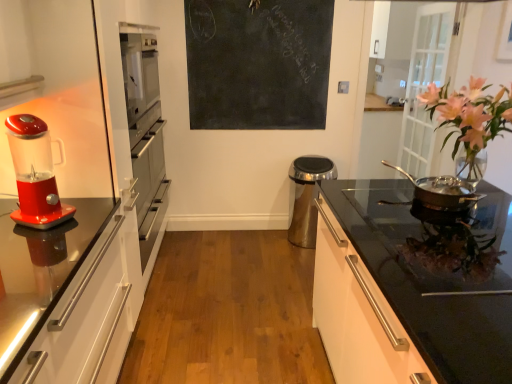
Question: Is shiny plastic blender at left to the left of shiny silver pan at right from the viewer's perspective?

Choices:
 (A) no
 (B) yes

Answer: (B)

Question: Can you confirm if shiny plastic blender at left is thinner than shiny silver pan at right?

Choices:
 (A) no
 (B) yes

Answer: (B)

Question: Is shiny plastic blender at left next to shiny silver pan at right?

Choices:
 (A) no
 (B) yes

Answer: (A)

Question: From a real-world perspective, is shiny plastic blender at left on top of shiny silver pan at right?

Choices:
 (A) no
 (B) yes

Answer: (B)

Question: Considering the relative sizes of shiny plastic blender at left and shiny silver pan at right in the image provided, is shiny plastic blender at left smaller than shiny silver pan at right?

Choices:
 (A) no
 (B) yes

Answer: (A)

Question: Looking at the image, does shiny plastic blender at left seem bigger or smaller compared to satin silver trash can at center?

Choices:
 (A) big
 (B) small

Answer: (B)

Question: From the image's perspective, is shiny plastic blender at left located above or below satin silver trash can at center?

Choices:
 (A) below
 (B) above

Answer: (B)

Question: Would you say shiny plastic blender at left is to the left or to the right of satin silver trash can at center in the picture?

Choices:
 (A) left
 (B) right

Answer: (A)

Question: Do you think shiny plastic blender at left is within satin silver trash can at center, or outside of it?

Choices:
 (A) outside
 (B) inside

Answer: (A)

Question: Does point click(214, 41) appear closer or farther from the camera than point click(463, 163)?

Choices:
 (A) closer
 (B) farther

Answer: (B)

Question: Is black chalkboard at upper center wider or thinner than pink glass vase at right?

Choices:
 (A) thin
 (B) wide

Answer: (A)

Question: From a real-world perspective, is black chalkboard at upper center above or below pink glass vase at right?

Choices:
 (A) above
 (B) below

Answer: (A)

Question: Is black chalkboard at upper center taller or shorter than pink glass vase at right?

Choices:
 (A) tall
 (B) short

Answer: (A)

Question: From the image's perspective, relative to shiny plastic blender at left, is pink glass vase at right above or below?

Choices:
 (A) below
 (B) above

Answer: (B)

Question: Looking at their shapes, would you say pink glass vase at right is wider or thinner than shiny plastic blender at left?

Choices:
 (A) thin
 (B) wide

Answer: (B)